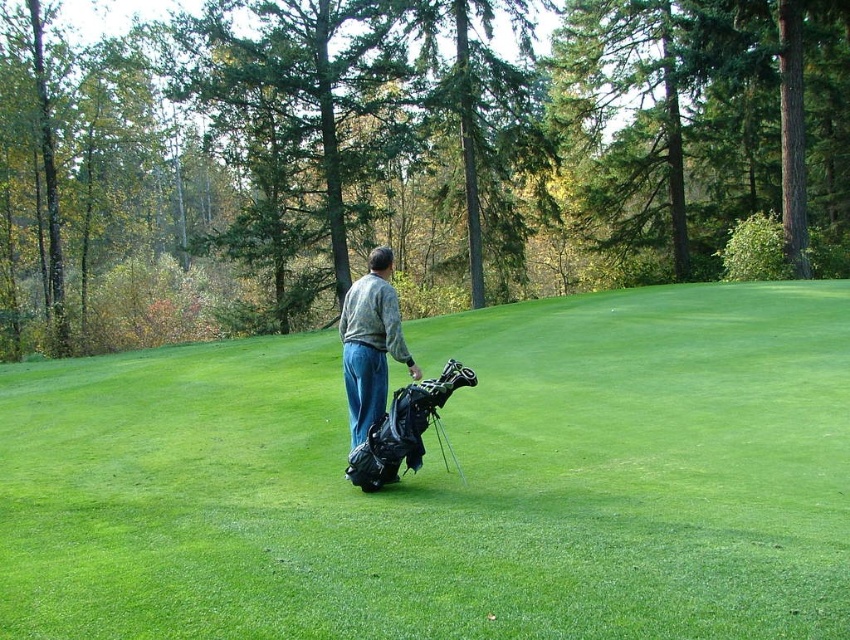
Question: Can you confirm if camouflage jacket at center is thinner than metallic silver golf club at center?

Choices:
 (A) no
 (B) yes

Answer: (A)

Question: Can you confirm if camouflage jacket at center is positioned below metallic silver golf club at center?

Choices:
 (A) no
 (B) yes

Answer: (A)

Question: Can you confirm if camouflage jacket at center is bigger than metallic silver golf club at center?

Choices:
 (A) no
 (B) yes

Answer: (B)

Question: Which object is closer to the camera taking this photo?

Choices:
 (A) metallic silver golf club at center
 (B) camouflage jacket at center
 (C) green grassy field at center

Answer: (C)

Question: Which object appears farthest from the camera in this image?

Choices:
 (A) metallic silver golf club at center
 (B) green grassy field at center
 (C) camouflage jacket at center

Answer: (A)

Question: Which point is farther from the camera taking this photo?

Choices:
 (A) (460, 477)
 (B) (656, 524)

Answer: (A)